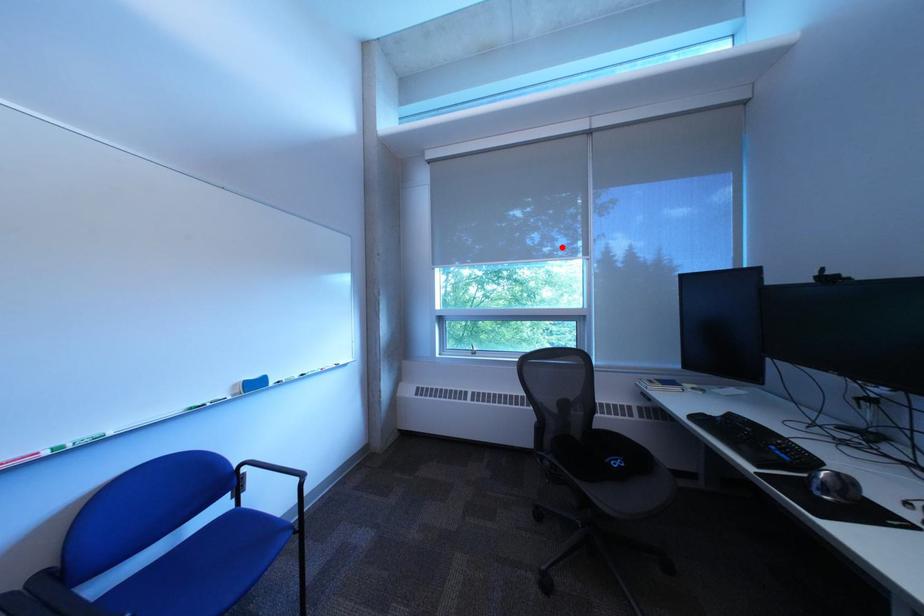
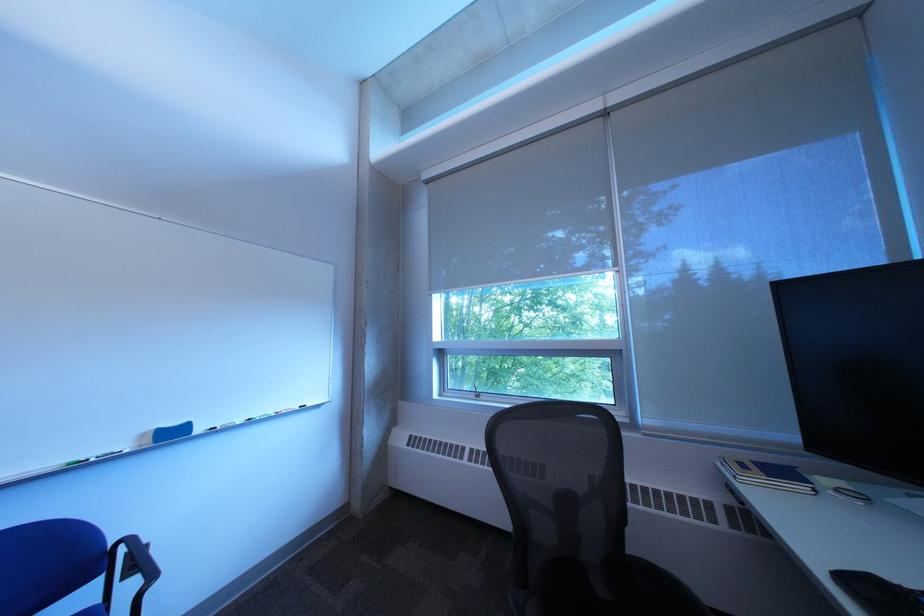
Question: I am providing you with two images of the same scene from different viewpoints. In image1, a red point is highlighted. Considering the same 3D point in image2, which of the following is correct?

Choices:
 (A) It is closer
 (B) It is farther

Answer: (A)